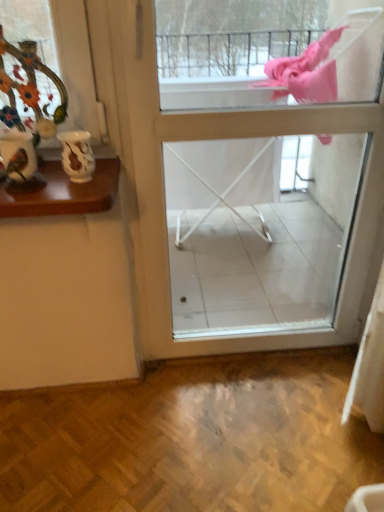
Find the location of a particular element. Image resolution: width=384 pixels, height=512 pixels. white glossy screen door at center is located at coordinates (227, 137).

This screenshot has height=512, width=384. Find the location of `porcelain vase at upper left`. porcelain vase at upper left is located at coordinates (30, 70).

Is white glossy screen door at center further to the viewer compared to white glossy vase at upper left?

No, white glossy screen door at center is closer to the camera.

Is white glossy screen door at center beside white glossy vase at upper left?

There is a gap between white glossy screen door at center and white glossy vase at upper left.

From the picture: From the image's perspective, between white glossy screen door at center and white glossy vase at upper left, who is located below?

white glossy screen door at center.

What's the angular difference between white glossy screen door at center and white glossy vase at upper left's facing directions?

They differ by 0.00074 degrees in their facing directions.

From the image's perspective, is porcelain vase at upper left beneath white glossy vase at upper left?

Actually, porcelain vase at upper left appears above white glossy vase at upper left in the image.

Is porcelain vase at upper left positioned behind white glossy vase at upper left?

That is False.

From a real-world perspective, does porcelain vase at upper left stand above white glossy vase at upper left?

Yes, from a real-world perspective, porcelain vase at upper left is over white glossy vase at upper left

Is porcelain vase at upper left oriented towards white glossy vase at upper left?

No, porcelain vase at upper left is not turned towards white glossy vase at upper left.

Is white glossy vase at upper left at the right side of porcelain vase at upper left?

Indeed, white glossy vase at upper left is positioned on the right side of porcelain vase at upper left.

Does white glossy vase at upper left have a larger size compared to porcelain vase at upper left?

No, white glossy vase at upper left is not bigger than porcelain vase at upper left.

Can you confirm if white glossy vase at upper left is wider than porcelain vase at upper left?

Yes, white glossy vase at upper left is wider than porcelain vase at upper left.

Between porcelain vase at upper left and white glossy screen door at center, which one has larger size?

With larger size is white glossy screen door at center.

Can we say porcelain vase at upper left lies outside white glossy screen door at center?

porcelain vase at upper left is positioned outside white glossy screen door at center.

Is porcelain vase at upper left wider than white glossy screen door at center?

No, porcelain vase at upper left is not wider than white glossy screen door at center.

From the image's perspective, is porcelain vase at upper left located above or below white glossy screen door at center?

From the image's perspective, porcelain vase at upper left appears above white glossy screen door at center.

Does white glossy vase at upper left touch white glossy screen door at center?

No, white glossy vase at upper left is not beside white glossy screen door at center.

Can you confirm if white glossy vase at upper left is smaller than white glossy screen door at center?

Yes, white glossy vase at upper left is smaller than white glossy screen door at center.

Is white glossy vase at upper left taller than white glossy screen door at center?

Incorrect, the height of white glossy vase at upper left is not larger of that of white glossy screen door at center.

Is point (82, 136) closer or farther from the camera than point (361, 114)?

Point (82, 136).

Which is behind, white glossy screen door at center or porcelain vase at upper left?

white glossy screen door at center is further away from the camera.

Would you say white glossy screen door at center is inside or outside porcelain vase at upper left?

white glossy screen door at center is outside porcelain vase at upper left.

Would you consider white glossy screen door at center to be distant from porcelain vase at upper left?

No, white glossy screen door at center is not far away from porcelain vase at upper left.

Consider the image. From the image's perspective, is white glossy screen door at center located above or below porcelain vase at upper left?

Based on their image positions, white glossy screen door at center is located beneath porcelain vase at upper left.

The height and width of the screenshot is (512, 384). Find the location of `vase located above the white glossy screen door at center (from the image's perspective)`. vase located above the white glossy screen door at center (from the image's perspective) is located at coordinates (77, 155).

Locate an element on the screen. Image resolution: width=384 pixels, height=512 pixels. window in front of the white glossy vase at upper left is located at coordinates (30, 70).

Estimate the real-world distances between objects in this image. Which object is closer to white glossy screen door at center, white glossy vase at upper left or porcelain vase at upper left?

Among the two, porcelain vase at upper left is located nearer to white glossy screen door at center.

From the image, which object appears to be nearer to white glossy vase at upper left, porcelain vase at upper left or white glossy screen door at center?

porcelain vase at upper left.

In the scene shown: From the image, which object appears to be nearer to porcelain vase at upper left, white glossy vase at upper left or white glossy screen door at center?

white glossy vase at upper left is positioned closer to the anchor porcelain vase at upper left.

From the image, which object appears to be nearer to white glossy screen door at center, porcelain vase at upper left or white glossy vase at upper left?

The object closer to white glossy screen door at center is porcelain vase at upper left.

In the scene shown: Based on their spatial positions, is white glossy screen door at center or white glossy vase at upper left further from porcelain vase at upper left?

Based on the image, white glossy screen door at center appears to be further to porcelain vase at upper left.

In the scene shown: When comparing their distances from white glossy vase at upper left, does white glossy screen door at center or porcelain vase at upper left seem closer?

Based on the image, porcelain vase at upper left appears to be nearer to white glossy vase at upper left.

Locate an element on the screen. vase located between porcelain vase at upper left and white glossy screen door at center in the left-right direction is located at coordinates [x=77, y=155].